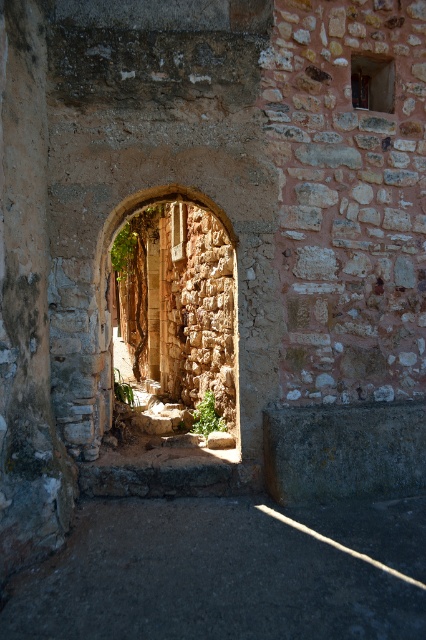
Question: Considering the relative positions of dark stone floor at lower center and rustic stone archway at center in the image provided, where is dark stone floor at lower center located with respect to rustic stone archway at center?

Choices:
 (A) above
 (B) below

Answer: (B)

Question: Is dark stone floor at lower center smaller than rustic stone archway at center?

Choices:
 (A) yes
 (B) no

Answer: (B)

Question: From the image, what is the correct spatial relationship of dark stone floor at lower center in relation to rustic stone archway at center?

Choices:
 (A) left
 (B) right

Answer: (B)